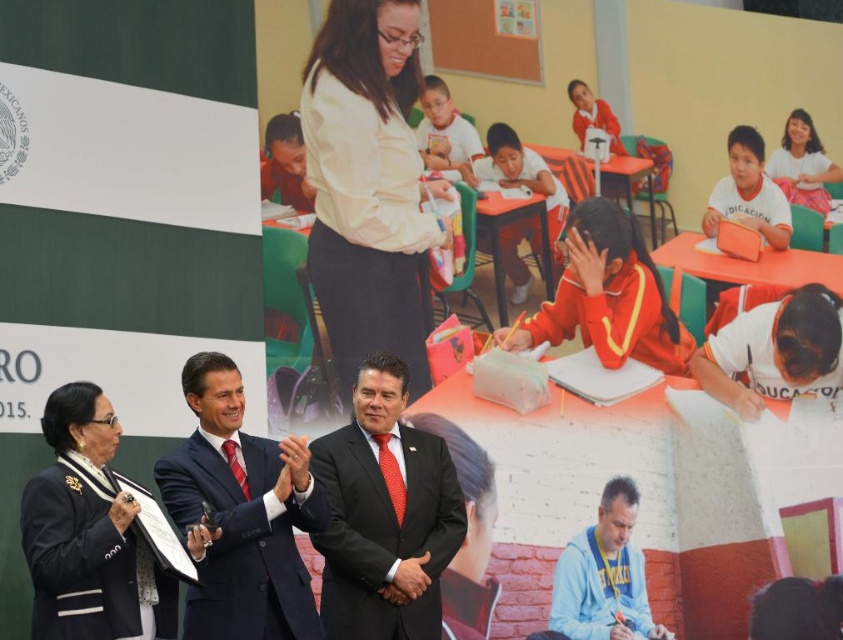
You are a photographer at the event and need to arrange the black leather jacket at lower left and the light blue fleece at lower right so that both are visible in the photo. Which item should you place closer to the camera to ensure both are fully visible?

The black leather jacket at lower left is shorter than the light blue fleece at lower right. To ensure both are fully visible, place the black leather jacket at lower left closer to the camera so its shorter height can be captured without being cut off, while the taller light blue fleece at lower right can be positioned slightly farther back.

You are organizing a coat rack for the event attendees. You have two coats to hang from the provided image. The black leather jacket at lower left and the light blue fleece at lower right. Which coat requires a larger hook to accommodate its size?

The light blue fleece at lower right requires a larger hook because it is bigger in size compared to the black leather jacket at lower left.